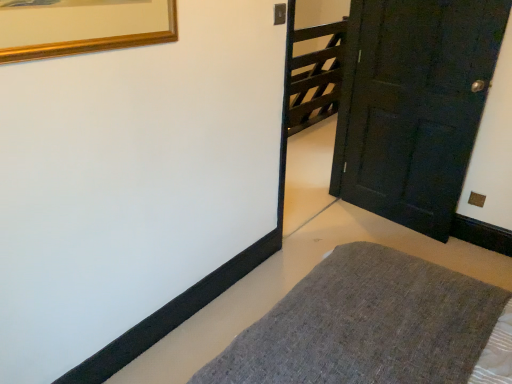
Question: Would you say matte black door at right is part of textured gray rug at lower center's contents?

Choices:
 (A) yes
 (B) no

Answer: (B)

Question: Is textured gray rug at lower center taller than matte black door at right?

Choices:
 (A) yes
 (B) no

Answer: (B)

Question: From the image's perspective, is textured gray rug at lower center below matte black door at right?

Choices:
 (A) yes
 (B) no

Answer: (A)

Question: Considering the relative sizes of textured gray rug at lower center and matte black door at right in the image provided, is textured gray rug at lower center wider than matte black door at right?

Choices:
 (A) no
 (B) yes

Answer: (B)

Question: Can we say textured gray rug at lower center lies outside matte black door at right?

Choices:
 (A) no
 (B) yes

Answer: (B)

Question: Considering the relative sizes of textured gray rug at lower center and matte black door at right in the image provided, is textured gray rug at lower center smaller than matte black door at right?

Choices:
 (A) yes
 (B) no

Answer: (B)

Question: Does matte black door at right lie behind dark wood gate at upper right?

Choices:
 (A) yes
 (B) no

Answer: (B)

Question: Would you say matte black door at right contains dark wood gate at upper right?

Choices:
 (A) no
 (B) yes

Answer: (A)

Question: Is matte black door at right bigger than dark wood gate at upper right?

Choices:
 (A) yes
 (B) no

Answer: (B)

Question: From the image's perspective, is matte black door at right located above dark wood gate at upper right?

Choices:
 (A) no
 (B) yes

Answer: (A)

Question: Could you tell me if matte black door at right is turned towards dark wood gate at upper right?

Choices:
 (A) yes
 (B) no

Answer: (B)

Question: From a real-world perspective, does matte black door at right stand above dark wood gate at upper right?

Choices:
 (A) no
 (B) yes

Answer: (B)

Question: Is matte black door at right completely or partially inside dark wood gate at upper right?

Choices:
 (A) no
 (B) yes

Answer: (A)